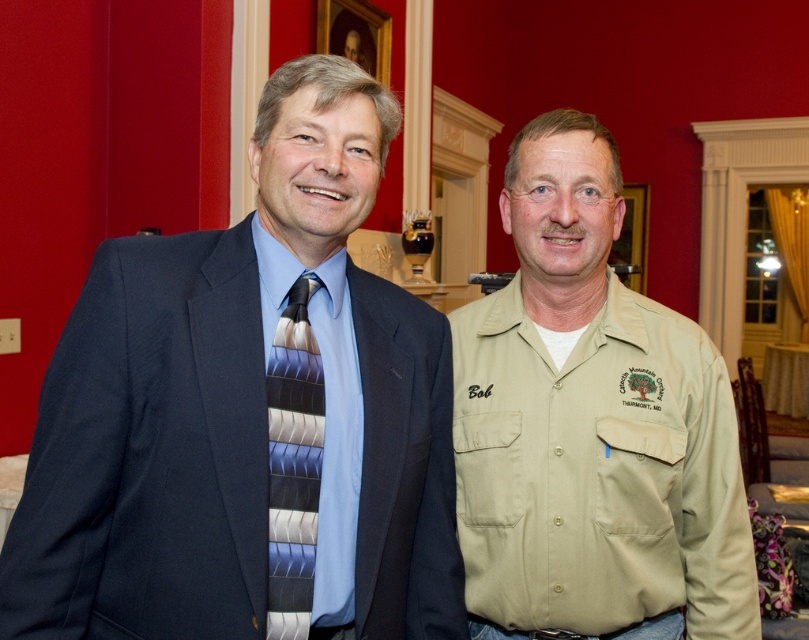
Question: Is matte black suit at center to the right of beige cotton shirt at center from the viewer's perspective?

Choices:
 (A) no
 (B) yes

Answer: (A)

Question: Can you confirm if matte black suit at center is positioned above silky striped tie at left?

Choices:
 (A) yes
 (B) no

Answer: (A)

Question: Does matte black suit at center have a larger size compared to silky striped tie at left?

Choices:
 (A) no
 (B) yes

Answer: (B)

Question: Which of the following is the closest to the observer?

Choices:
 (A) beige cotton shirt at center
 (B) silky striped tie at left

Answer: (B)

Question: Which point is farther to the camera?

Choices:
 (A) (295, 396)
 (B) (153, 474)

Answer: (A)

Question: Which point is closer to the camera taking this photo?

Choices:
 (A) (541, 248)
 (B) (280, 595)
 (C) (413, 392)

Answer: (B)